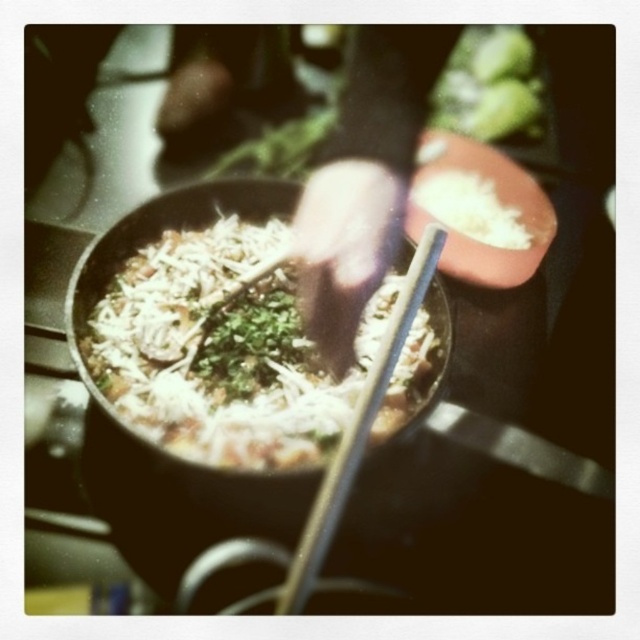
Looking at this image, you are a chef preparing a dish and need to place a garnish on the white shredded cheese at center. According to the image, where exactly should you place the garnish?

The white shredded cheese at center is located at point [221,349], so you should place the garnish at that coordinate.

You are a chef trying to determine which of the two points, point (x=173, y=250) or point (x=508, y=61), is nearer to the camera in this cooking scene. Based on the image, which point is closer?

Point (x=173, y=250) is closer to the camera than point (x=508, y=61).